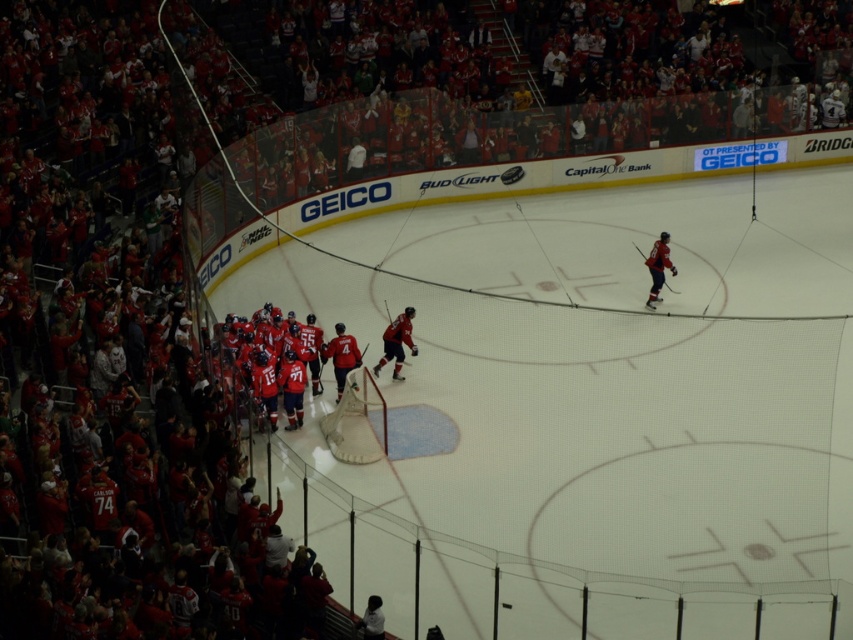
Is point (335, 381) positioned before point (671, 262)?

Yes.

Between point (335, 349) and point (648, 305), which one is positioned behind?

Point (648, 305)

Which is in front, point (339, 353) or point (647, 262)?

Point (339, 353) is in front.

Find the location of `red jersey at center`. red jersey at center is located at coordinates (341, 355).

Is point (398, 316) in front of point (654, 280)?

Yes.

Between point (395, 340) and point (671, 262), which one is positioned behind?

Positioned behind is point (671, 262).

Is point (410, 348) closer to viewer compared to point (647, 301)?

That is True.

Locate an element on the screen. matte black hockey stick at center is located at coordinates (398, 340).

In the scene shown: Which of these two, matte red jersey at center or matte red jersey at right, stands shorter?

matte red jersey at center is shorter.

Who is more forward, (399, 339) or (653, 275)?

Point (399, 339) is more forward.

I want to click on matte red jersey at center, so click(x=396, y=342).